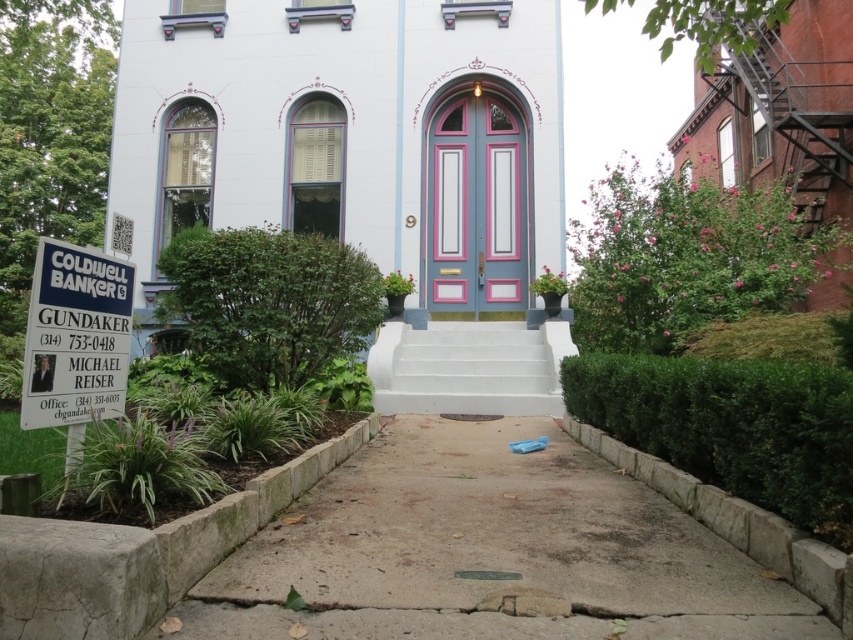
Between matte white church at center and white plastic coldwell banker sign at left, which one appears on the left side from the viewer's perspective?

matte white church at center

Can you confirm if matte white church at center is positioned above white plastic coldwell banker sign at left?

Yes, matte white church at center is above white plastic coldwell banker sign at left.

Does point (438, 193) lie behind point (102, 292)?

Yes.

Find the location of a particular element. matte white church at center is located at coordinates (364, 168).

Who is higher up, gray concrete pavement at center or white plastic coldwell banker sign at left?

Positioned higher is white plastic coldwell banker sign at left.

Can you confirm if gray concrete pavement at center is thinner than white plastic coldwell banker sign at left?

In fact, gray concrete pavement at center might be wider than white plastic coldwell banker sign at left.

Between point (311, 518) and point (109, 353), which one is positioned behind?

Point (311, 518)

This screenshot has width=853, height=640. In order to click on gray concrete pavement at center in this screenshot , I will do `click(489, 552)`.

Does point (448, 472) come farther from viewer compared to point (761, 120)?

No, (448, 472) is closer to viewer.

Between gray concrete pavement at center and rustic brick fire escape at right, which one appears on the left side from the viewer's perspective?

From the viewer's perspective, gray concrete pavement at center appears more on the left side.

Between point (212, 612) and point (811, 3), which one is positioned behind?

The point (811, 3) is behind.

Where is `gray concrete pavement at center`? gray concrete pavement at center is located at coordinates (489, 552).